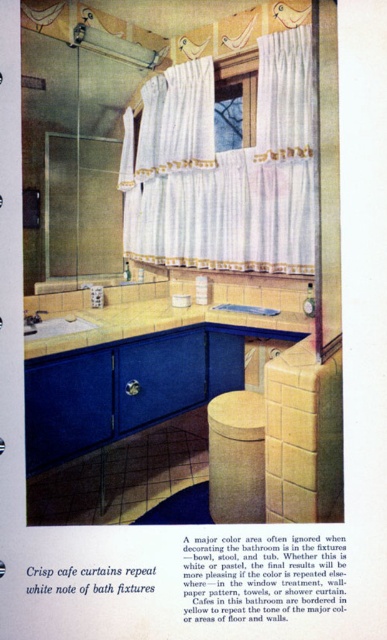
You are standing in the bathroom and want to place a new plant pot on the wooden textured stool at center. Given the stool is at coordinates 0.716, 0.612, where exactly should you place the plant pot?

The plant pot should be placed on the wooden textured stool at center, which is located at coordinates (236, 458).

You are planning to replace the white sheer curtain at upper center with a new one that is exactly the same width as the matte white sink at lower left. Based on the current setup, will the new curtain be wider or narrower than the existing one?

The white sheer curtain at upper center is currently wider than the matte white sink at lower left. Therefore, replacing it with a curtain matching the sink width would make the new curtain narrower than the existing one.

You are a contractor measuring the bathroom for new fixtures. You need to place a new towel rack that must be at least 1.5 meters away from any existing objects. The wooden textured stool at center and the brushed metal faucet at lower left are in the way. Which object requires more space to be considered for the rack placement?

The wooden textured stool at center requires more space to be considered for the rack placement because it has a larger size compared to the brushed metal faucet at lower left, so the minimum distance must be measured from it.